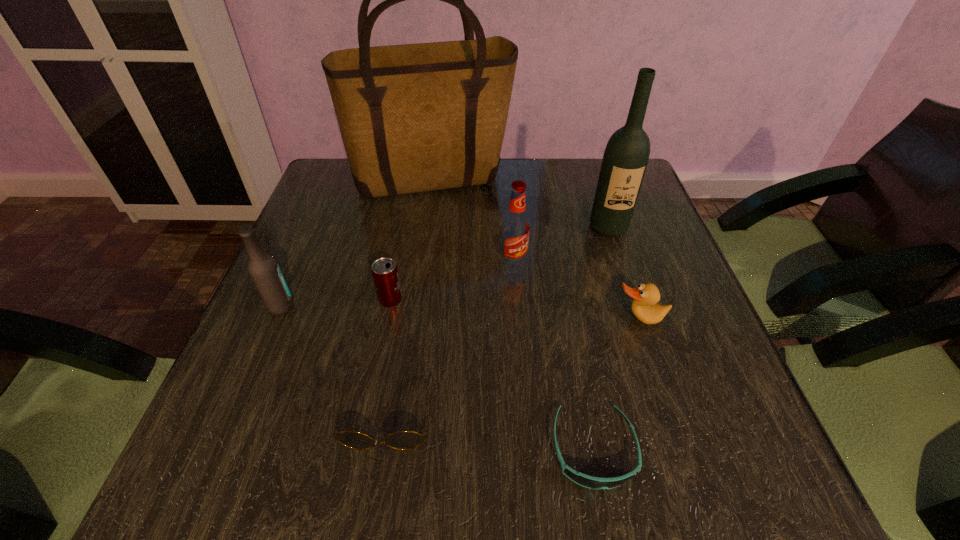
Locate an element on the screen. The width and height of the screenshot is (960, 540). unoccupied position between the left sunglasses and the beer can is located at coordinates (390, 357).

Image resolution: width=960 pixels, height=540 pixels. I want to click on free space between the root beer and the taller sunglasses, so click(x=451, y=339).

The height and width of the screenshot is (540, 960). I want to click on empty space between the tote bag and the leftmost object, so click(357, 244).

At what (x,y) coordinates should I click in order to perform the action: click on empty space that is in between the tallest object and the beer bottle. Please return your answer as a coordinate pair (x, y). The image size is (960, 540). Looking at the image, I should click on (357, 244).

The height and width of the screenshot is (540, 960). Find the location of `empty location between the wine bottle and the beer bottle`. empty location between the wine bottle and the beer bottle is located at coordinates (444, 267).

The height and width of the screenshot is (540, 960). I want to click on vacant space in between the left sunglasses and the tallest object, so click(x=411, y=298).

Find the location of a particular element. free space between the third farthest object and the seventh shortest object is located at coordinates (561, 246).

The height and width of the screenshot is (540, 960). I want to click on free point between the taller sunglasses and the seventh nearest object, so click(498, 321).

Where is `vacant area that lies between the leftmost object and the tallest object`? This screenshot has height=540, width=960. vacant area that lies between the leftmost object and the tallest object is located at coordinates (357, 244).

Locate an element on the screen. The image size is (960, 540). free point between the tallest object and the beer can is located at coordinates (412, 240).